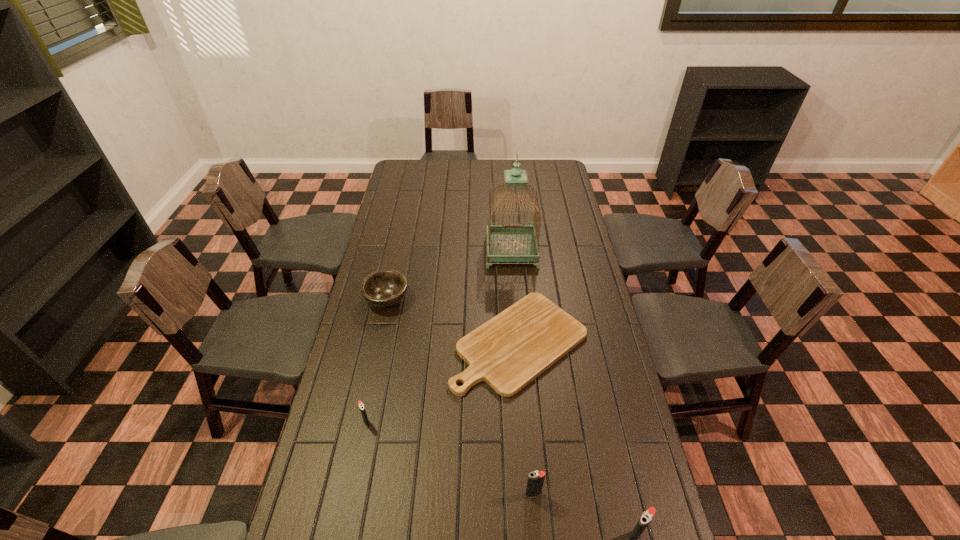
The width and height of the screenshot is (960, 540). I want to click on blank space at the far left corner, so click(426, 169).

In the image, there is a desktop. Identify the location of vacant space at the far right corner. (559, 166).

The height and width of the screenshot is (540, 960). What are the coordinates of `vacant space that is in between the shortest igniter and the second tallest igniter` in the screenshot? It's located at pyautogui.click(x=450, y=458).

Where is `vacant area that lies between the second shortest object and the chopping board`? This screenshot has width=960, height=540. vacant area that lies between the second shortest object and the chopping board is located at coordinates (453, 321).

Identify the location of vacant space that is in between the third tallest object and the shortest object. The image size is (960, 540). (526, 418).

Find the location of `unoccupied position between the shortest igniter and the shortest object`. unoccupied position between the shortest igniter and the shortest object is located at coordinates (444, 382).

The image size is (960, 540). I want to click on free space between the chopping board and the farthest object, so click(x=516, y=296).

The width and height of the screenshot is (960, 540). I want to click on vacant space that's between the farthest object and the fifth tallest object, so click(x=449, y=275).

Find the location of a particular element. Image resolution: width=960 pixels, height=540 pixels. the closest object to the fifth tallest object is located at coordinates (510, 350).

This screenshot has width=960, height=540. I want to click on object that is the second nearest to the second farthest igniter, so (510, 350).